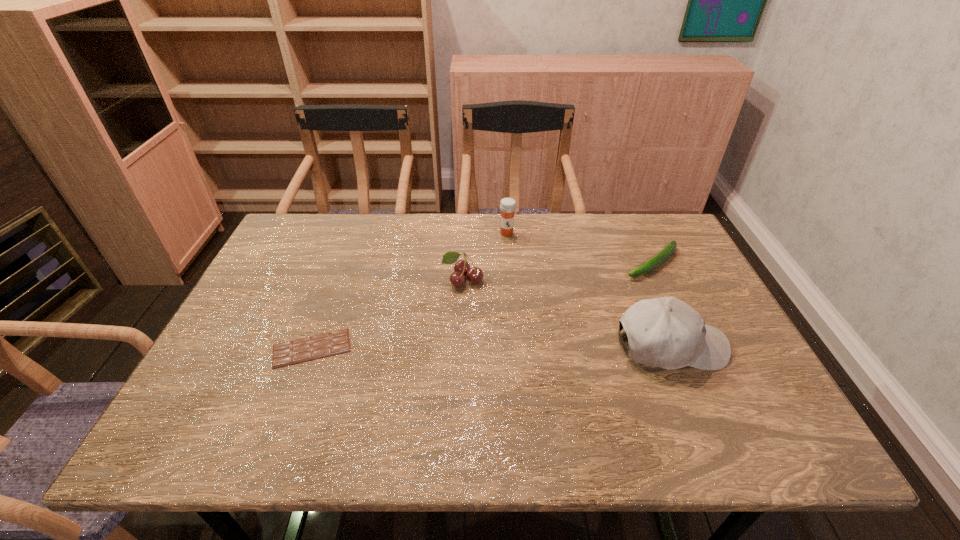
Point out which object is positioned as the second nearest to the chocolate bar. Please provide its 2D coordinates. Your answer should be formatted as a tuple, i.e. [(x, y)], where the tuple contains the x and y coordinates of a point satisfying the conditions above.

[(508, 205)]

You are a GUI agent. You are given a task and a screenshot of the screen. Output one action in this format:
    pyautogui.click(x=<x>, y=<y>)
    Task: Click on the object that is the fourth closest to the zucchini
    This screenshot has width=960, height=540.
    Given the screenshot: What is the action you would take?
    pyautogui.click(x=305, y=349)

Locate an element on the screen. This screenshot has width=960, height=540. vacant space that satisfies the following two spatial constraints: 1. on the back side of the cherry; 2. on the left side of the leftmost object is located at coordinates (337, 280).